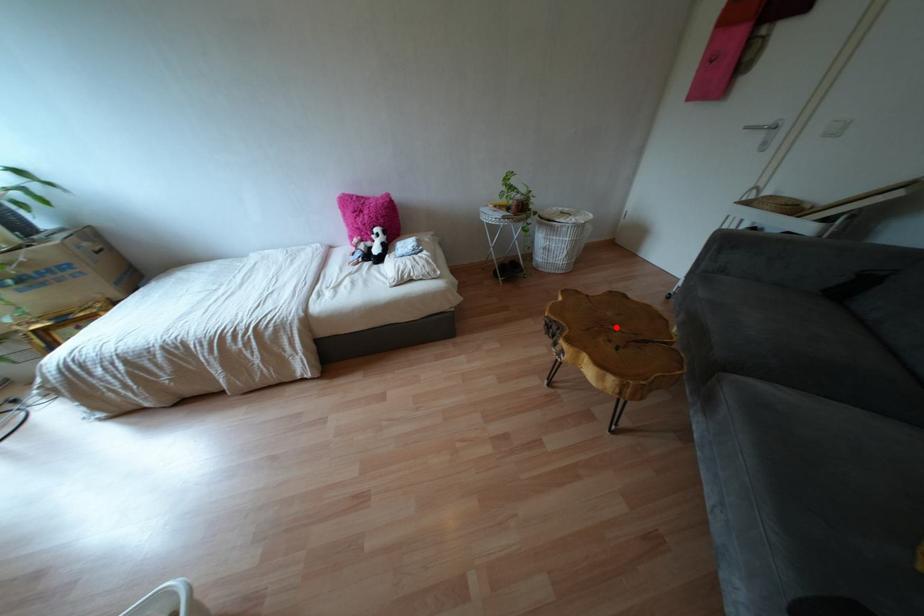
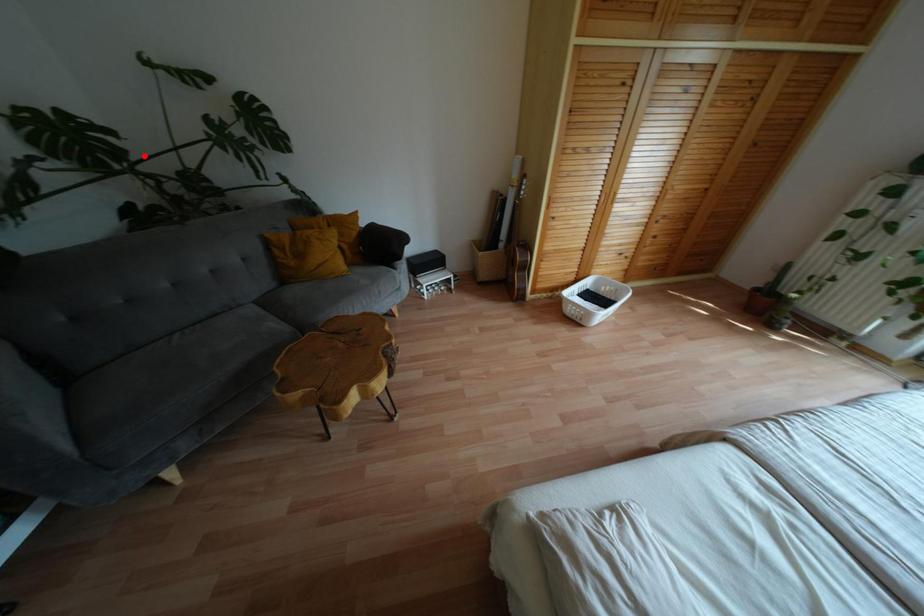
I am providing you with two images of the same scene from different viewpoints. A red point is marked on the first image and another point is marked on the second image. Does the point marked in image1 correspond to the same location as the one in image2?

No